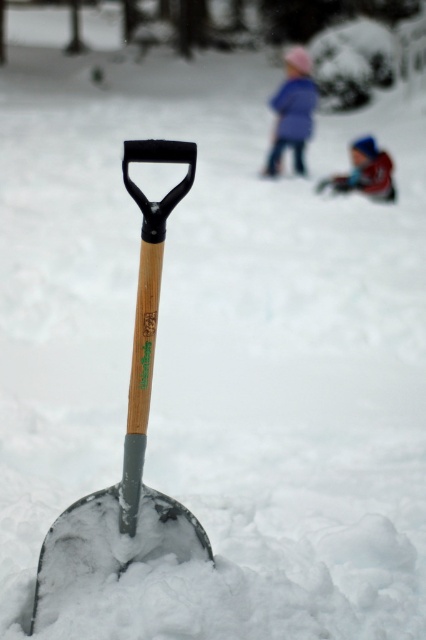
Question: Which point is closer to the camera taking this photo?

Choices:
 (A) (143, 145)
 (B) (273, 150)
 (C) (385, 193)

Answer: (A)

Question: Can you confirm if metallic silver shovel at center is positioned below blue woolen sweater at upper center?

Choices:
 (A) yes
 (B) no

Answer: (A)

Question: Does metallic silver shovel at center have a smaller size compared to blue woolen sweater at upper center?

Choices:
 (A) yes
 (B) no

Answer: (A)

Question: Based on their relative distances, which object is farther from the metallic silver shovel at center?

Choices:
 (A) blue woolen sweater at upper center
 (B) blue knit hat at upper center

Answer: (A)

Question: Can you confirm if metallic silver shovel at center is thinner than blue woolen sweater at upper center?

Choices:
 (A) yes
 (B) no

Answer: (A)

Question: Which of the following is the farthest from the observer?

Choices:
 (A) metallic silver shovel at center
 (B) blue woolen sweater at upper center

Answer: (B)